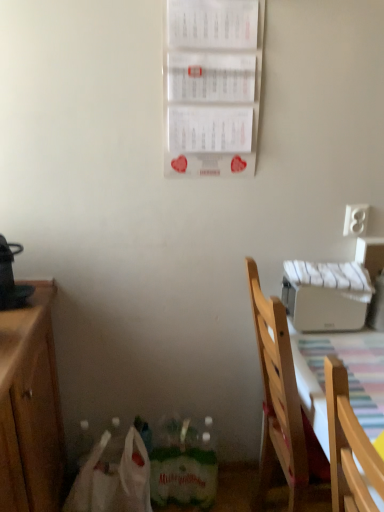
Question: Considering the relative positions of white plastic bag at lower left and white matte printer at upper right in the image provided, is white plastic bag at lower left to the right of white matte printer at upper right from the viewer's perspective?

Choices:
 (A) yes
 (B) no

Answer: (B)

Question: Can you confirm if white plastic bag at lower left is thinner than white matte printer at upper right?

Choices:
 (A) no
 (B) yes

Answer: (A)

Question: Is white plastic bag at lower left further to the viewer compared to white matte printer at upper right?

Choices:
 (A) yes
 (B) no

Answer: (B)

Question: From a real-world perspective, does white plastic bag at lower left stand above white matte printer at upper right?

Choices:
 (A) yes
 (B) no

Answer: (B)

Question: Considering the relative sizes of white plastic bag at lower left and white matte printer at upper right in the image provided, is white plastic bag at lower left smaller than white matte printer at upper right?

Choices:
 (A) no
 (B) yes

Answer: (A)

Question: Can white matte printer at upper right be found inside white plastic bag at lower left?

Choices:
 (A) no
 (B) yes

Answer: (A)

Question: Does white matte printer at upper right have a larger size compared to white paper calendar at upper center?

Choices:
 (A) yes
 (B) no

Answer: (A)

Question: Is white matte printer at upper right in contact with white paper calendar at upper center?

Choices:
 (A) yes
 (B) no

Answer: (B)

Question: Can you confirm if white matte printer at upper right is wider than white paper calendar at upper center?

Choices:
 (A) no
 (B) yes

Answer: (B)

Question: From a real-world perspective, is white matte printer at upper right over white paper calendar at upper center?

Choices:
 (A) yes
 (B) no

Answer: (B)

Question: Does white matte printer at upper right come in front of white paper calendar at upper center?

Choices:
 (A) yes
 (B) no

Answer: (B)

Question: Is white matte printer at upper right further to the viewer compared to white paper calendar at upper center?

Choices:
 (A) yes
 (B) no

Answer: (A)

Question: From the image's perspective, is white paper calendar at upper center below striped fabric tablecloth at lower right?

Choices:
 (A) no
 (B) yes

Answer: (A)